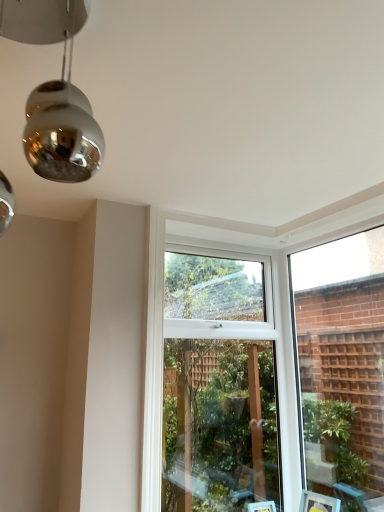
Describe the element at coordinates (218, 387) in the screenshot. I see `clear glass window at center` at that location.

At what (x,y) coordinates should I click in order to perform the action: click on clear glass window at center. Please return your answer as a coordinate pair (x, y). This screenshot has height=512, width=384. Looking at the image, I should click on (x=218, y=387).

Measure the distance between point [196,490] and camera.

Point [196,490] and camera are 3.28 meters apart from each other.

This screenshot has height=512, width=384. What do you see at coordinates (342, 364) in the screenshot? I see `clear glass window at upper right` at bounding box center [342, 364].

At what (x,y) coordinates should I click in order to perform the action: click on clear glass window at upper right. Please return your answer as a coordinate pair (x, y). Looking at the image, I should click on (x=342, y=364).

Identify the location of clear glass window at center. (218, 387).

Which object is positioned more to the left, clear glass window at upper right or clear glass window at center?

clear glass window at center.

Relative to clear glass window at center, is clear glass window at upper right in front or behind?

Clearly, clear glass window at upper right is in front of clear glass window at center.

Which is closer, (348, 508) or (234, 402)?

Point (348, 508) is closer to the camera than point (234, 402).

Consider the image. From the image's perspective, who appears lower, clear glass window at upper right or clear glass window at center?

clear glass window at center is shown below in the image.

From the picture: From a real-world perspective, is clear glass window at upper right located beneath clear glass window at center?

Yes, from a real-world perspective, clear glass window at upper right is under clear glass window at center.

Which object is wider, clear glass window at upper right or clear glass window at center?

Wider between the two is clear glass window at center.

Which of these two, clear glass window at upper right or clear glass window at center, stands shorter?

clear glass window at upper right is shorter.

Which of these two, clear glass window at upper right or clear glass window at center, is bigger?

clear glass window at center.

Would you say clear glass window at center is part of clear glass window at upper right's contents?

No, clear glass window at center is not surrounded by clear glass window at upper right.

Is clear glass window at upper right far from clear glass window at center?

clear glass window at upper right is actually quite close to clear glass window at center.

Does clear glass window at upper right turn towards clear glass window at center?

Yes, clear glass window at upper right is oriented towards clear glass window at center.

What's the angular difference between clear glass window at upper right and clear glass window at center's facing directions?

89.1 degrees.

Measure the distance from clear glass window at upper right to clear glass window at center.

clear glass window at upper right is 29.84 inches from clear glass window at center.

Locate an element on the screen. window frame on the right of clear glass window at center is located at coordinates [342, 364].

Is clear glass window at center to the right of clear glass window at upper right from the viewer's perspective?

Incorrect, clear glass window at center is not on the right side of clear glass window at upper right.

Which object is closer to the camera, clear glass window at center or clear glass window at upper right?

clear glass window at upper right is closer to the camera.

Is point (220, 290) in front of point (301, 380)?

Yes, it is in front of point (301, 380).

From the image's perspective, is clear glass window at center under clear glass window at upper right?

Yes, from the image's perspective, clear glass window at center is beneath clear glass window at upper right.

From a real-world perspective, is clear glass window at center physically below clear glass window at upper right?

No, from a real-world perspective, clear glass window at center is not beneath clear glass window at upper right.

Which of these two, clear glass window at center or clear glass window at upper right, is wider?

Wider between the two is clear glass window at center.

From the picture: Considering the sizes of objects clear glass window at center and clear glass window at upper right in the image provided, who is taller, clear glass window at center or clear glass window at upper right?

clear glass window at center is taller.

Can you confirm if clear glass window at center is bigger than clear glass window at upper right?

Indeed, clear glass window at center has a larger size compared to clear glass window at upper right.

Would you say clear glass window at upper right is part of clear glass window at center's contents?

No, clear glass window at upper right is not a part of clear glass window at center.

Are clear glass window at center and clear glass window at upper right far apart?

No, clear glass window at center is not far from clear glass window at upper right.

Could you tell me if clear glass window at center is facing clear glass window at upper right?

Yes, clear glass window at center faces towards clear glass window at upper right.

Measure the distance between clear glass window at center and clear glass window at upper right.

A distance of 29.84 inches exists between clear glass window at center and clear glass window at upper right.

Find the location of `window behind the clear glass window at upper right`. window behind the clear glass window at upper right is located at coordinates (218, 387).

Find the location of a particular element. window above the clear glass window at upper right (from a real-world perspective) is located at coordinates (218, 387).

Where is `window frame located underneath the clear glass window at center (from a real-world perspective)`? This screenshot has width=384, height=512. window frame located underneath the clear glass window at center (from a real-world perspective) is located at coordinates (342, 364).